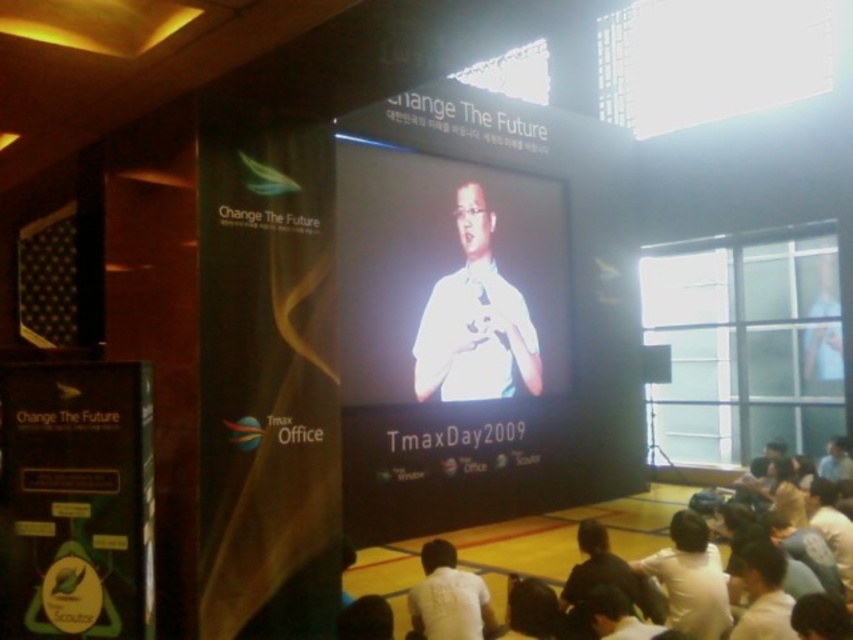
Question: Which object is positioned farthest from the white matte shirt at center?

Choices:
 (A) white glossy screen at center
 (B) white matte shirt at lower center

Answer: (B)

Question: Among these objects, which one is farthest from the camera?

Choices:
 (A) white matte shirt at lower center
 (B) white matte shirt at center
 (C) white glossy screen at center
 (D) white cotton shirt at lower center

Answer: (B)

Question: Based on their relative distances, which object is farther from the white cotton shirt at lower center?

Choices:
 (A) white glossy screen at center
 (B) white matte shirt at center

Answer: (A)

Question: Does white cotton shirt at lower center have a lesser width compared to white matte shirt at lower center?

Choices:
 (A) no
 (B) yes

Answer: (A)

Question: Is white glossy screen at center below white cotton shirt at lower center?

Choices:
 (A) yes
 (B) no

Answer: (B)

Question: Is white glossy screen at center below white cotton shirt at lower center?

Choices:
 (A) yes
 (B) no

Answer: (B)